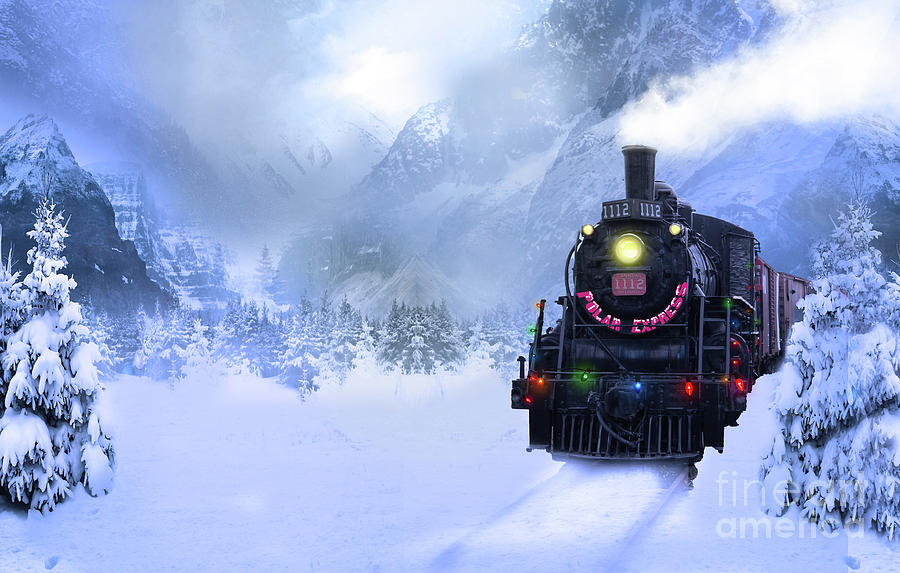
The image size is (900, 573). Identify the location of line of christmas lights. (627, 376), (734, 341), (532, 344).